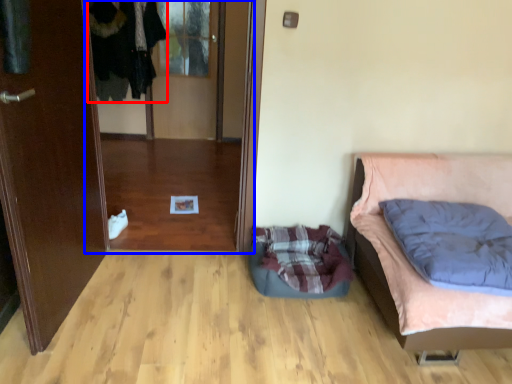
Question: Among these objects, which one is nearest to the camera, clothing (highlighted by a red box) or glass door (highlighted by a blue box)?

Choices:
 (A) clothing
 (B) glass door

Answer: (B)